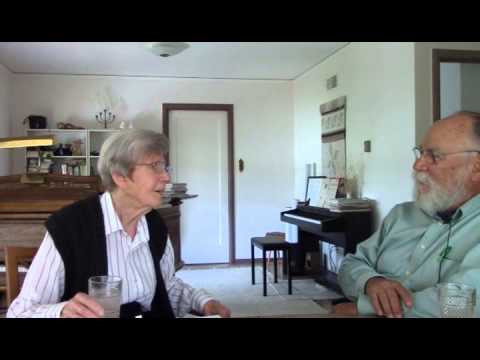
Where is `ceiling`? ceiling is located at coordinates (249, 58).